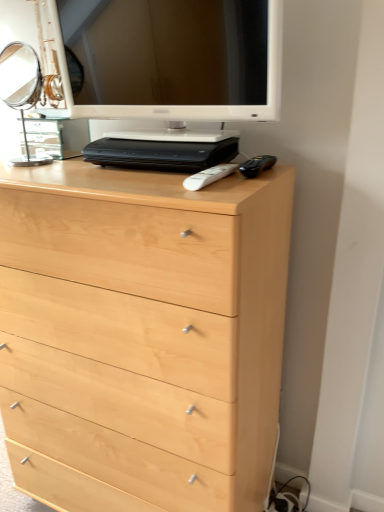
What is the approximate width of light wood chest of drawers at center?

It is 18.13 inches.

Locate an element on the screen. white glossy computer monitor at upper center is located at coordinates (176, 59).

Locate an element on the screen. The width and height of the screenshot is (384, 512). polished silver mirror at upper left is located at coordinates (21, 87).

From a real-world perspective, who is located higher, polished silver mirror at upper left or white glossy computer monitor at upper center?

white glossy computer monitor at upper center.

From the image's perspective, who appears lower, polished silver mirror at upper left or white glossy computer monitor at upper center?

polished silver mirror at upper left.

Considering the relative sizes of polished silver mirror at upper left and white glossy computer monitor at upper center in the image provided, is polished silver mirror at upper left bigger than white glossy computer monitor at upper center?

Actually, polished silver mirror at upper left might be smaller than white glossy computer monitor at upper center.

From the image's perspective, which is above, white plastic remote at center or light wood chest of drawers at center?

white plastic remote at center, from the image's perspective.

From a real-world perspective, is white plastic remote at center physically below light wood chest of drawers at center?

Actually, white plastic remote at center is physically above light wood chest of drawers at center in the real world.

Does white plastic remote at center contain light wood chest of drawers at center?

No, light wood chest of drawers at center is not a part of white plastic remote at center.

This screenshot has width=384, height=512. What are the coordinates of `chest of drawers below the white plastic remote at center (from the image's perspective)` in the screenshot? It's located at (142, 336).

Is light wood chest of drawers at center facing towards white plastic remote at center?

No, light wood chest of drawers at center is not turned towards white plastic remote at center.

Looking at this image, considering the positions of objects light wood chest of drawers at center and white plastic remote at center in the image provided, who is in front, light wood chest of drawers at center or white plastic remote at center?

light wood chest of drawers at center.

In terms of width, does light wood chest of drawers at center look wider or thinner when compared to white plastic remote at center?

Considering their sizes, light wood chest of drawers at center looks broader than white plastic remote at center.

The image size is (384, 512). What are the coordinates of `table lamp above the white plastic remote at center (from a real-world perspective)` in the screenshot? It's located at (21, 87).

Which is more to the right, polished silver mirror at upper left or white plastic remote at center?

white plastic remote at center.

From the picture: From a real-world perspective, which object stands above the other?

polished silver mirror at upper left.

Which of these two, polished silver mirror at upper left or white plastic remote at center, stands shorter?

white plastic remote at center.

From a real-world perspective, is white glossy computer monitor at upper center located beneath white plastic remote at center?

Actually, white glossy computer monitor at upper center is physically above white plastic remote at center in the real world.

Is the depth of white glossy computer monitor at upper center less than that of white plastic remote at center?

That is True.

Is white glossy computer monitor at upper center at the left side of white plastic remote at center?

Correct, you'll find white glossy computer monitor at upper center to the left of white plastic remote at center.

Is white glossy computer monitor at upper center outside of white plastic remote at center?

Absolutely, white glossy computer monitor at upper center is external to white plastic remote at center.

Consider the image. Which object is further away from the camera taking this photo, white plastic remote at center or white glossy computer monitor at upper center?

Positioned behind is white plastic remote at center.

Locate an element on the screen. remote that appears on the right of white glossy computer monitor at upper center is located at coordinates (208, 176).

Is white plastic remote at center bigger or smaller than white glossy computer monitor at upper center?

In the image, white plastic remote at center appears to be smaller than white glossy computer monitor at upper center.

What's the angular difference between white plastic remote at center and white glossy computer monitor at upper center's facing directions?

0.000563 degrees.

Which is more to the left, polished silver mirror at upper left or light wood chest of drawers at center?

polished silver mirror at upper left.

From a real-world perspective, who is located lower, polished silver mirror at upper left or light wood chest of drawers at center?

light wood chest of drawers at center is physically lower.

Does polished silver mirror at upper left lie in front of light wood chest of drawers at center?

No, it is behind light wood chest of drawers at center.

Image resolution: width=384 pixels, height=512 pixels. Identify the location of computer monitor that is on the right side of polished silver mirror at upper left. (176, 59).

Find the location of a particular element. remote behind the light wood chest of drawers at center is located at coordinates 208,176.

Based on their spatial positions, is white plastic remote at center or light wood chest of drawers at center closer to polished silver mirror at upper left?

light wood chest of drawers at center is positioned closer to the anchor polished silver mirror at upper left.

Considering their positions, is light wood chest of drawers at center positioned further to polished silver mirror at upper left than white plastic remote at center?

Among the two, white plastic remote at center is located further to polished silver mirror at upper left.

Based on their spatial positions, is white glossy computer monitor at upper center or polished silver mirror at upper left further from white plastic remote at center?

Based on the image, polished silver mirror at upper left appears to be further to white plastic remote at center.

When comparing their distances from light wood chest of drawers at center, does white glossy computer monitor at upper center or white plastic remote at center seem further?

white plastic remote at center is positioned further to the anchor light wood chest of drawers at center.

Looking at the image, which one is located closer to light wood chest of drawers at center, white plastic remote at center or polished silver mirror at upper left?

white plastic remote at center.

From the image, which object appears to be nearer to white glossy computer monitor at upper center, light wood chest of drawers at center or white plastic remote at center?

white plastic remote at center is closer to white glossy computer monitor at upper center.

When comparing their distances from polished silver mirror at upper left, does white glossy computer monitor at upper center or white plastic remote at center seem further?

white plastic remote at center.

Based on their spatial positions, is white plastic remote at center or polished silver mirror at upper left further from white glossy computer monitor at upper center?

polished silver mirror at upper left is further to white glossy computer monitor at upper center.

Locate an element on the screen. This screenshot has height=512, width=384. remote between white glossy computer monitor at upper center and light wood chest of drawers at center in the up-down direction is located at coordinates (208, 176).

Where is `remote between polished silver mirror at upper left and light wood chest of drawers at center in the up-down direction`? The height and width of the screenshot is (512, 384). remote between polished silver mirror at upper left and light wood chest of drawers at center in the up-down direction is located at coordinates (208, 176).

You are a GUI agent. You are given a task and a screenshot of the screen. Output one action in this format:
    pyautogui.click(x=<x>, y=<y>)
    Task: Click on the computer monitor between polished silver mirror at upper left and white plastic remote at center in the horizontal direction
    
    Given the screenshot: What is the action you would take?
    pyautogui.click(x=176, y=59)

Find the location of `table lamp between white glossy computer monitor at upper center and light wood chest of drawers at center vertically`. table lamp between white glossy computer monitor at upper center and light wood chest of drawers at center vertically is located at coordinates (21, 87).